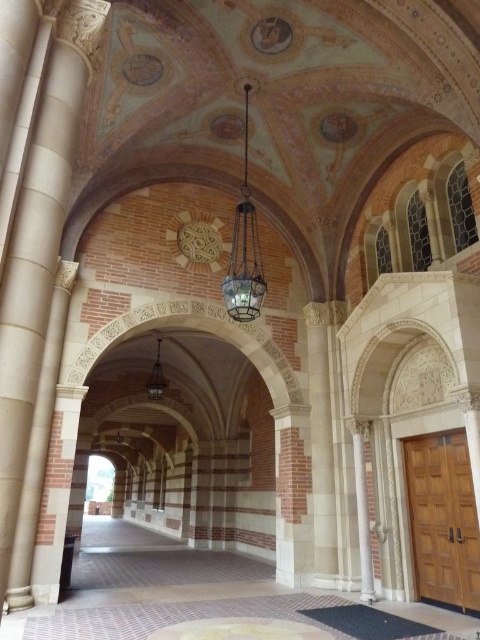
From the picture: Who is lower down, metallic glass chandelier at center or white marble column at center?

Positioned lower is white marble column at center.

Does metallic glass chandelier at center lie in front of white marble column at center?

Yes, metallic glass chandelier at center is in front of white marble column at center.

Find the location of a particular element. The image size is (480, 640). metallic glass chandelier at center is located at coordinates (244, 250).

Identify the location of metallic glass chandelier at center. (244, 250).

Is metallic glass chandelier at center shorter than matte brass lamp at center?

Yes.

How much distance is there between metallic glass chandelier at center and matte brass lamp at center?

metallic glass chandelier at center is 7.98 meters from matte brass lamp at center.

Is point (261, 268) farther from camera compared to point (151, 374)?

No.

Locate an element on the screen. The height and width of the screenshot is (640, 480). metallic glass chandelier at center is located at coordinates (244, 250).

Is white marble column at center to the right of matte brass lamp at center from the viewer's perspective?

→ Yes, white marble column at center is to the right of matte brass lamp at center.

Is white marble column at center above matte brass lamp at center?

Incorrect, white marble column at center is not positioned above matte brass lamp at center.

The image size is (480, 640). I want to click on white marble column at center, so point(361,509).